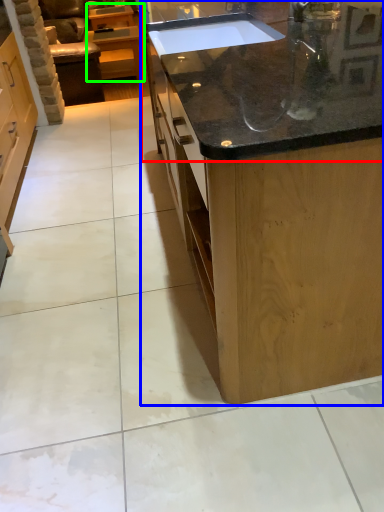
Question: Which object is the farthest from countertop (highlighted by a red box)? Choose among these: countertop (highlighted by a blue box) or cabinetry (highlighted by a green box).

Choices:
 (A) countertop
 (B) cabinetry

Answer: (B)